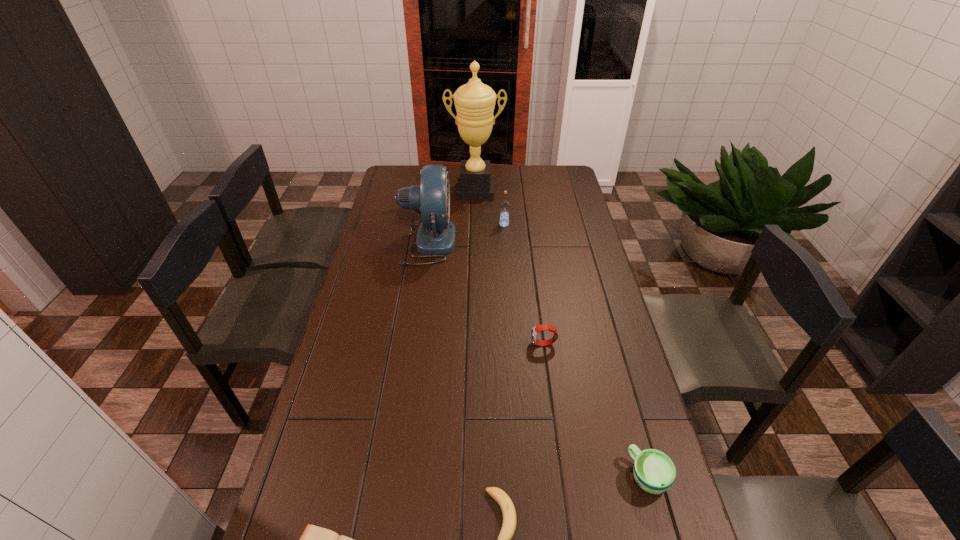
In the image, there is a desktop. At what (x,y) coordinates should I click in order to perform the action: click on vacant space at the far right corner. Please return your answer as a coordinate pair (x, y). Looking at the image, I should click on (562, 184).

You are a GUI agent. You are given a task and a screenshot of the screen. Output one action in this format:
    pyautogui.click(x=<x>, y=<y>)
    Task: Click on the vacant area that lies between the sixth shortest object and the trophy cup
    The image size is (960, 540).
    Given the screenshot: What is the action you would take?
    pyautogui.click(x=452, y=217)

The width and height of the screenshot is (960, 540). In order to click on vacant space that's between the tallest object and the watch in this screenshot , I will do tap(510, 268).

I want to click on vacant area that lies between the trophy cup and the second tallest object, so click(x=452, y=217).

Find the location of a particular element. The width and height of the screenshot is (960, 540). free space between the rightmost object and the tallest object is located at coordinates (562, 334).

This screenshot has width=960, height=540. I want to click on unoccupied position between the vodka and the trophy cup, so click(490, 208).

You are a GUI agent. You are given a task and a screenshot of the screen. Output one action in this format:
    pyautogui.click(x=<x>, y=<y>)
    Task: Click on the vacant space in between the cup and the sixth shortest object
    The height and width of the screenshot is (540, 960).
    Given the screenshot: What is the action you would take?
    pyautogui.click(x=538, y=359)

At what (x,y) coordinates should I click in order to perform the action: click on vacant point located between the cup and the second object from right to left. Please return your answer as a coordinate pair (x, y). Looking at the image, I should click on (595, 410).

This screenshot has height=540, width=960. I want to click on unoccupied position between the cup and the third tallest object, so click(x=576, y=350).

This screenshot has width=960, height=540. Identify the location of free space between the vodka and the trophy cup. (490, 208).